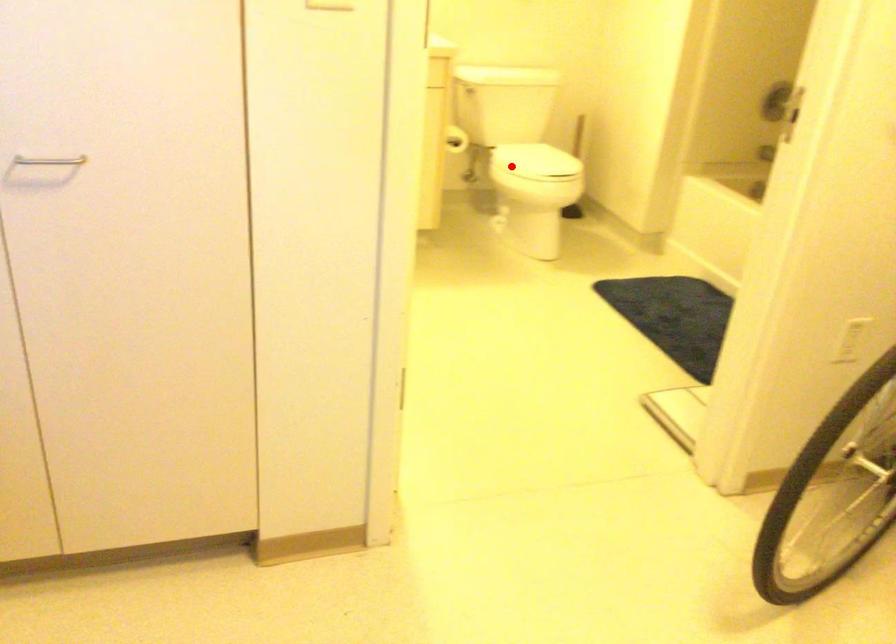
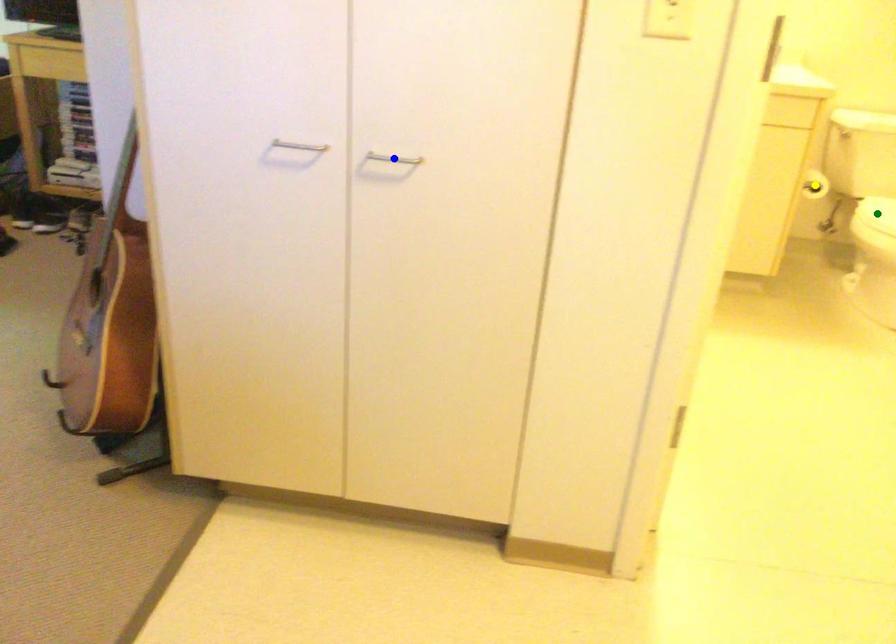
Question: I am providing you with two images of the same scene from different viewpoints. A red point is marked on the first image. You are given multiple points on the second image. Which point in image 2 is actually the same real-world point as the red point in image 1?

Choices:
 (A) green point
 (B) blue point
 (C) yellow point

Answer: (A)